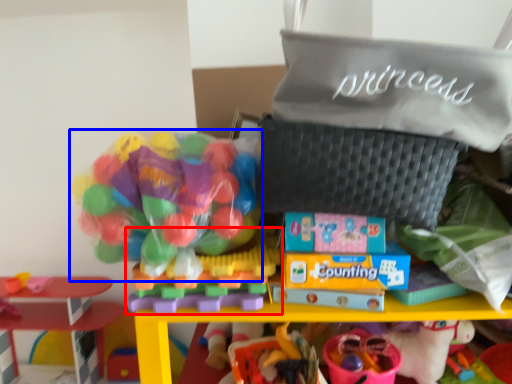
Question: Among these objects, which one is nearest to the camera, toy (highlighted by a red box) or toy (highlighted by a blue box)?

Choices:
 (A) toy
 (B) toy

Answer: (B)